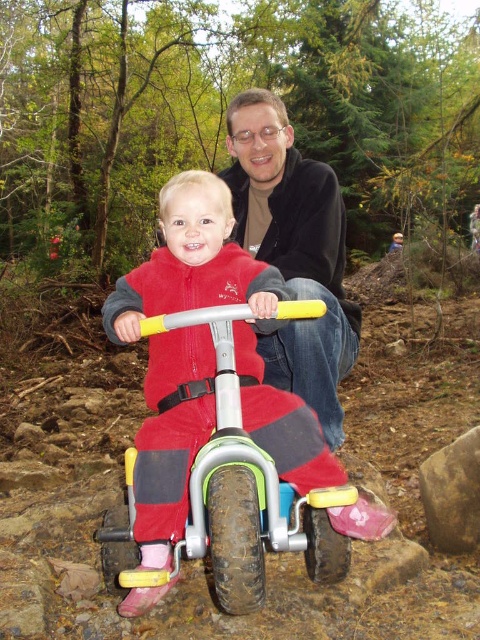
Is matte black jacket at upper center taller than brown rough rock at lower right?

Yes, matte black jacket at upper center is taller than brown rough rock at lower right.

Who is higher up, matte black jacket at upper center or brown rough rock at lower right?

matte black jacket at upper center is above.

At what (x,y) coordinates should I click in order to perform the action: click on matte black jacket at upper center. Please return your answer as a coordinate pair (x, y). Looking at the image, I should click on (294, 252).

Which of these two, rubberized plastic tricycle at center or brown rough rock at lower right, stands shorter?

Standing shorter between the two is brown rough rock at lower right.

Looking at this image, how distant is rubberized plastic tricycle at center from brown rough rock at lower right?

→ The distance of rubberized plastic tricycle at center from brown rough rock at lower right is 5.69 feet.

Does point (259, 484) come closer to viewer compared to point (431, 480)?

Yes, it is in front of point (431, 480).

Where is `rubberized plastic tricycle at center`? rubberized plastic tricycle at center is located at coordinates (243, 492).

Is point (304, 515) positioned in front of point (294, 348)?

That is True.

Is point (309, 308) behind point (292, 330)?

No, (309, 308) is in front of (292, 330).

Where is `rubberized plastic tricycle at center`? Image resolution: width=480 pixels, height=640 pixels. rubberized plastic tricycle at center is located at coordinates (243, 492).